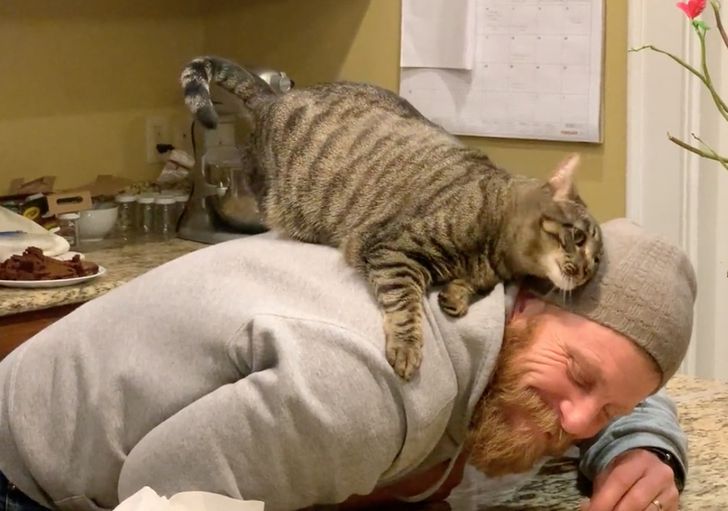
Identify the location of calendar. This screenshot has width=728, height=511. (547, 68).